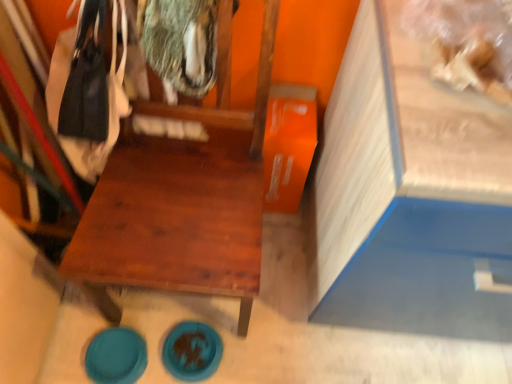
Where is `vacant space to the left of teal glossy plate at lower left, which ranks as the 1th plate in left-to-right order`? The height and width of the screenshot is (384, 512). vacant space to the left of teal glossy plate at lower left, which ranks as the 1th plate in left-to-right order is located at coordinates (69, 346).